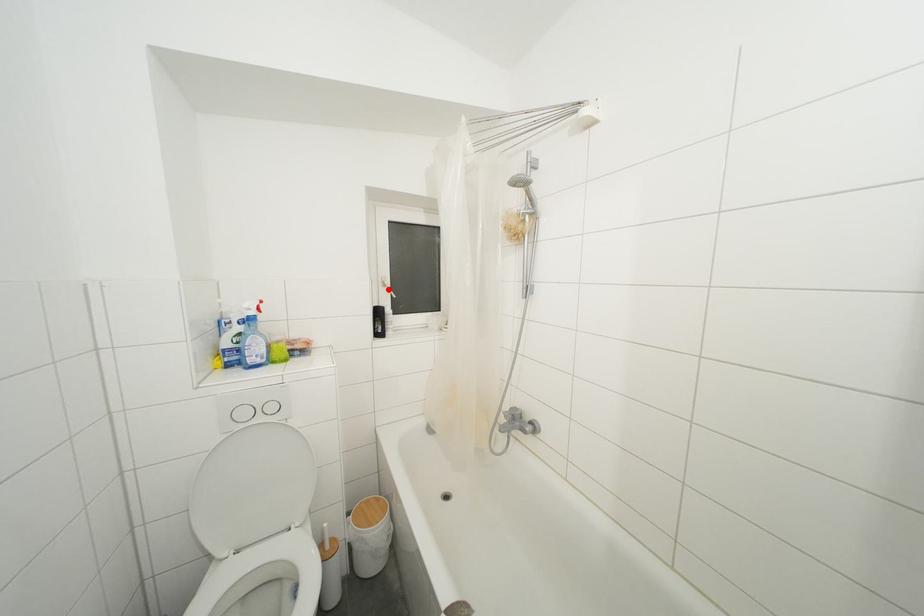
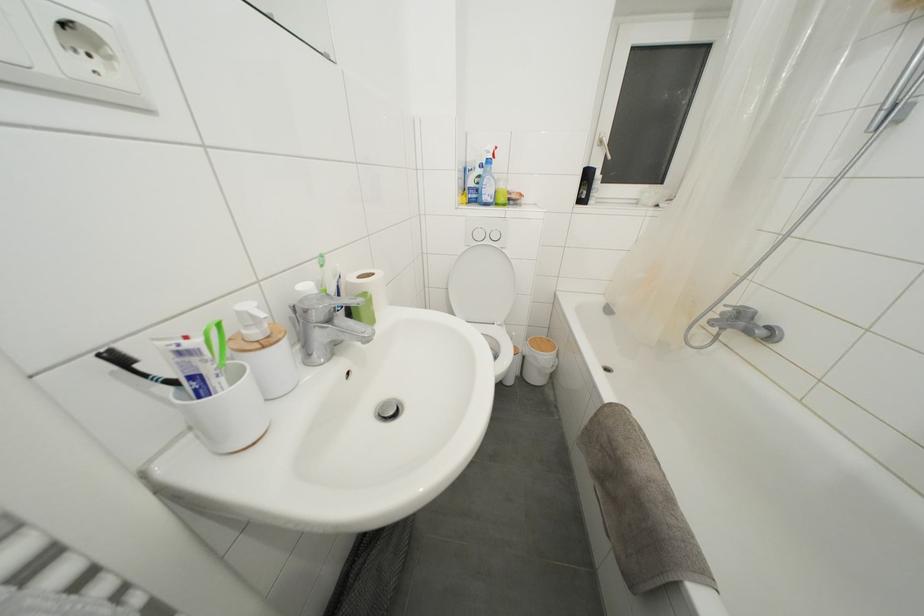
The point at the highlighted location is marked in the first image. Where is the corresponding point in the second image?

(604, 148)